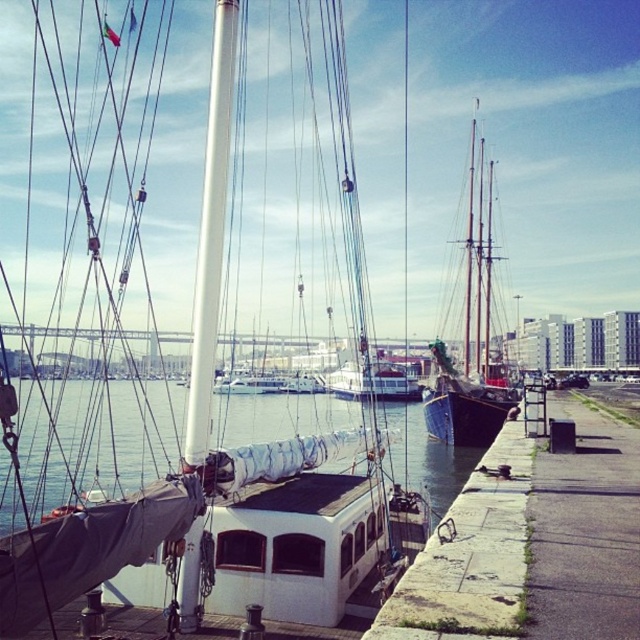
You are standing at the edge of the harbor looking out. There are two points marked in the scene, one at coordinate point (346, 580) and another at point (492, 259). Which point is closer to you?

Point (346, 580) is closer to the viewer than point (492, 259).

You are a photographer standing at the edge of the harbor. You want to capture a photo of the dark blue wooden sailboat at center and the white glossy sailboat at center. Based on their positions, which boat should you focus on first to ensure both are in the frame?

The dark blue wooden sailboat at center is located above the white glossy sailboat at center, so you should focus on the dark blue wooden sailboat at center first to ensure both are in the frame.

You are standing at the edge of the harbor looking out. There is a point marked at coordinates point (433, 406). If you want to throw a small floating marker to that point, and your maximum throwing distance is 120 feet, will you be able to reach it?

The point (433, 406) is 135.32 feet away from the viewer. Since your maximum throwing distance is 120 feet, you cannot reach it.